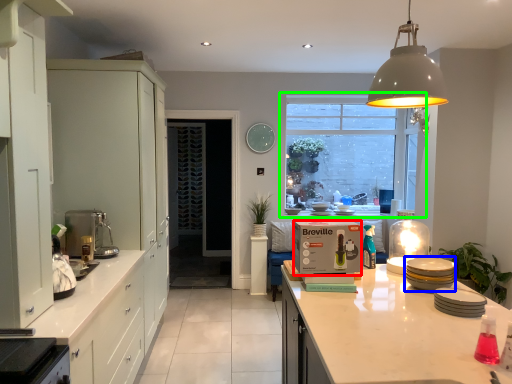
Question: Which object is positioned farthest from cardboard box (highlighted by a red box)? Select from appliance (highlighted by a blue box) and window (highlighted by a green box).

Choices:
 (A) appliance
 (B) window

Answer: (B)